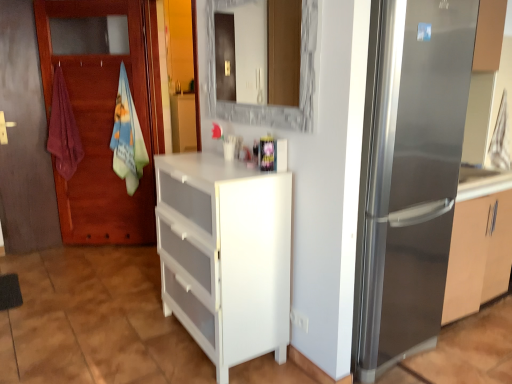
Question: Is white plastic chest of drawers at center at the back of satin silver refrigerator at right?

Choices:
 (A) no
 (B) yes

Answer: (A)

Question: Is white plastic chest of drawers at center surrounded by satin silver refrigerator at right?

Choices:
 (A) yes
 (B) no

Answer: (B)

Question: Is satin silver refrigerator at right at the left side of white plastic chest of drawers at center?

Choices:
 (A) no
 (B) yes

Answer: (A)

Question: Could you tell me if satin silver refrigerator at right is facing white plastic chest of drawers at center?

Choices:
 (A) no
 (B) yes

Answer: (A)

Question: From a real-world perspective, does satin silver refrigerator at right stand above white plastic chest of drawers at center?

Choices:
 (A) yes
 (B) no

Answer: (A)

Question: From the image's perspective, relative to white plastic chest of drawers at center, is wooden door at left above or below?

Choices:
 (A) above
 (B) below

Answer: (A)

Question: Is wooden door at left wider or thinner than white plastic chest of drawers at center?

Choices:
 (A) wide
 (B) thin

Answer: (B)

Question: Relative to white plastic chest of drawers at center, is wooden door at left in front or behind?

Choices:
 (A) front
 (B) behind

Answer: (B)

Question: Is wooden door at left to the left or to the right of white plastic chest of drawers at center in the image?

Choices:
 (A) right
 (B) left

Answer: (B)

Question: From the image's perspective, is maroon cotton towel at left, positioned as the second beach towel in right-to-left order, above or below satin silver refrigerator at right?

Choices:
 (A) above
 (B) below

Answer: (A)

Question: From a real-world perspective, relative to satin silver refrigerator at right, is maroon cotton towel at left, positioned as the second beach towel in right-to-left order, vertically above or below?

Choices:
 (A) above
 (B) below

Answer: (A)

Question: Would you say maroon cotton towel at left, positioned as the first beach towel in left-to-right order, is inside or outside satin silver refrigerator at right?

Choices:
 (A) outside
 (B) inside

Answer: (A)

Question: Is maroon cotton towel at left, positioned as the second beach towel in right-to-left order, in front of or behind satin silver refrigerator at right in the image?

Choices:
 (A) behind
 (B) front

Answer: (A)

Question: From a real-world perspective, is white plastic chest of drawers at center physically located above or below wooden door at left?

Choices:
 (A) above
 (B) below

Answer: (B)

Question: Based on their positions, is white plastic chest of drawers at center located to the left or right of wooden door at left?

Choices:
 (A) left
 (B) right

Answer: (B)